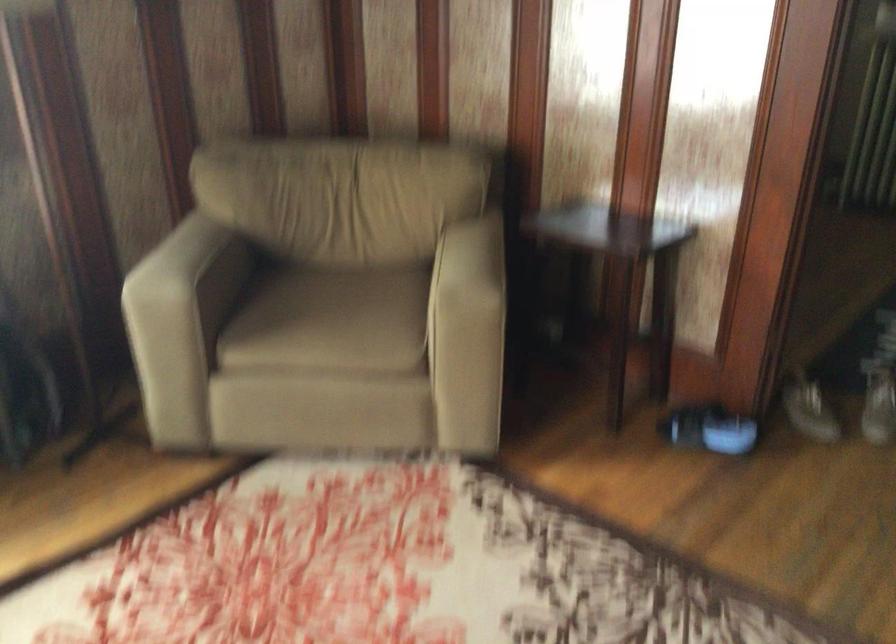
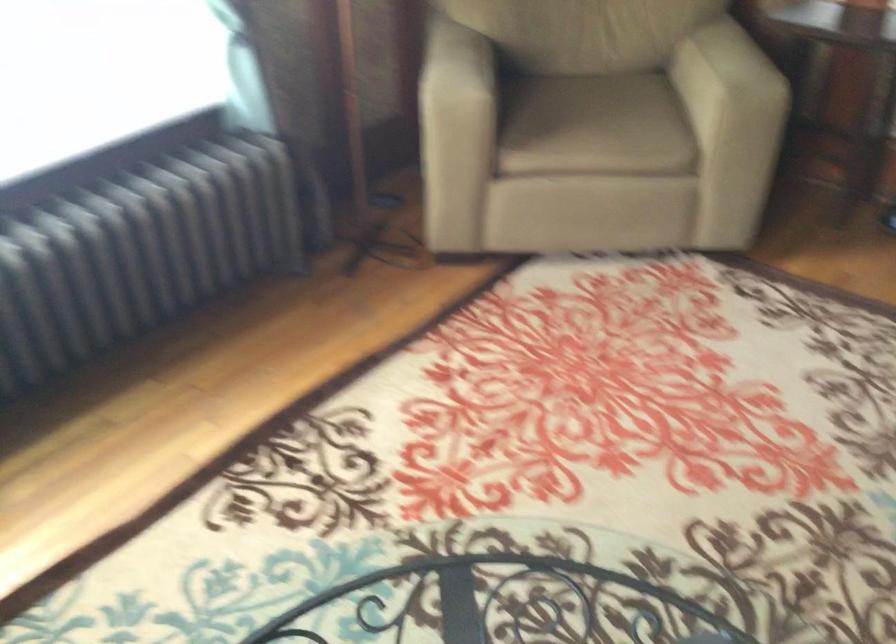
Question: What movement of the cameraman would produce the second image?

Choices:
 (A) Left
 (B) Right
 (C) Forward
 (D) Backward

Answer: (A)